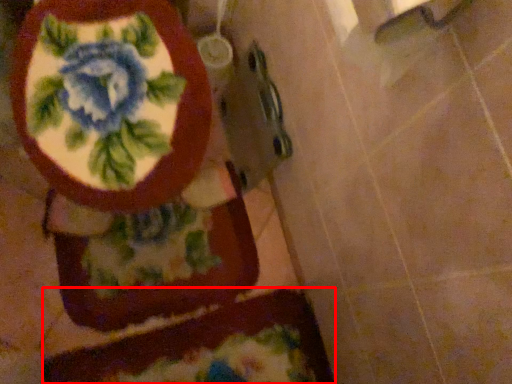
Question: Observing the image, what is the correct spatial positioning of bath mat (annotated by the red box) in reference to toilet?

Choices:
 (A) left
 (B) right

Answer: (B)